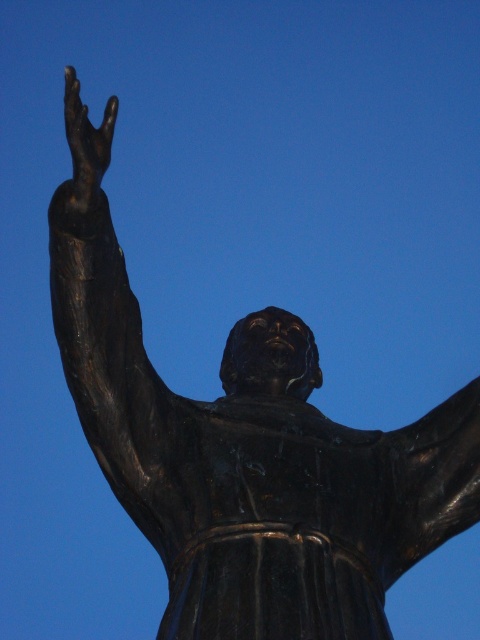
Can you confirm if black polished statue arm at upper left is positioned to the right of black polished hand at upper left?

No, black polished statue arm at upper left is not to the right of black polished hand at upper left.

Does point (59, 195) come closer to viewer compared to point (76, 128)?

No, it is not.

Where is `black polished statue arm at upper left`? The image size is (480, 640). black polished statue arm at upper left is located at coordinates (103, 314).